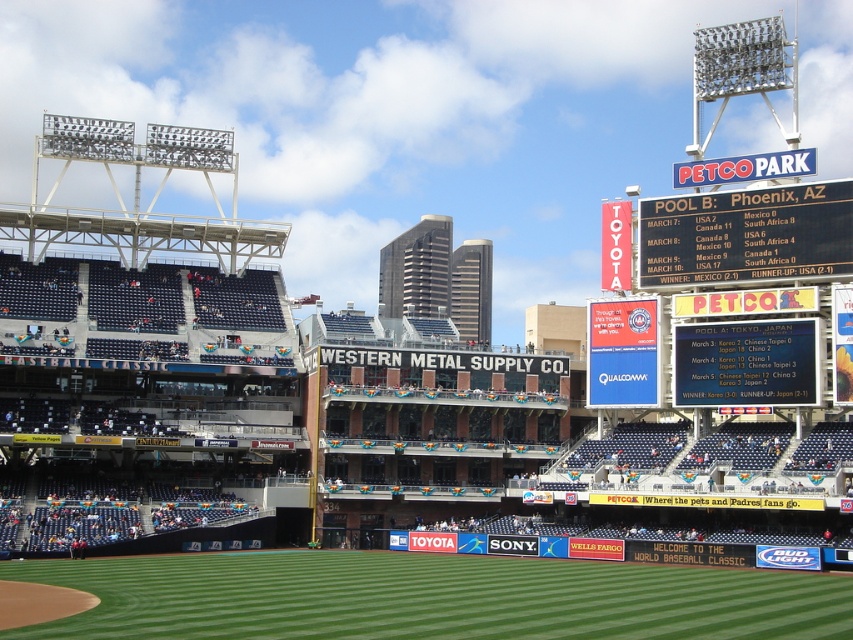
Question: Which point appears closest to the camera in this image?

Choices:
 (A) (746, 227)
 (B) (718, 388)

Answer: (B)

Question: Which point is farther to the camera?

Choices:
 (A) white plastic scoreboard at upper right
 (B) black plastic scoreboard at upper right

Answer: (B)

Question: Which object is positioned farthest from the white plastic scoreboard at upper right?

Choices:
 (A) black plastic scoreboard at upper right
 (B) green grass at lower center

Answer: (B)

Question: Does green grass at lower center have a lesser width compared to black plastic scoreboard at upper right?

Choices:
 (A) no
 (B) yes

Answer: (A)

Question: Considering the relative positions of green grass at lower center and black plastic scoreboard at upper right in the image provided, where is green grass at lower center located with respect to black plastic scoreboard at upper right?

Choices:
 (A) right
 (B) left

Answer: (B)

Question: Is green grass at lower center below white plastic scoreboard at upper right?

Choices:
 (A) no
 (B) yes

Answer: (B)